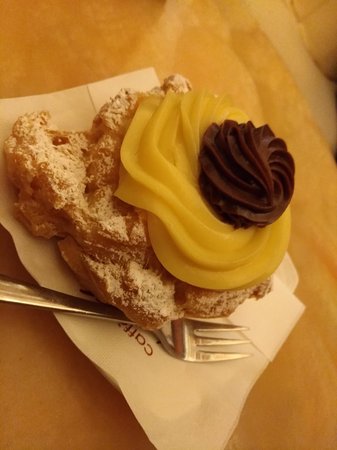
This screenshot has height=450, width=337. What are the coordinates of `table` in the screenshot? It's located at (81, 376).